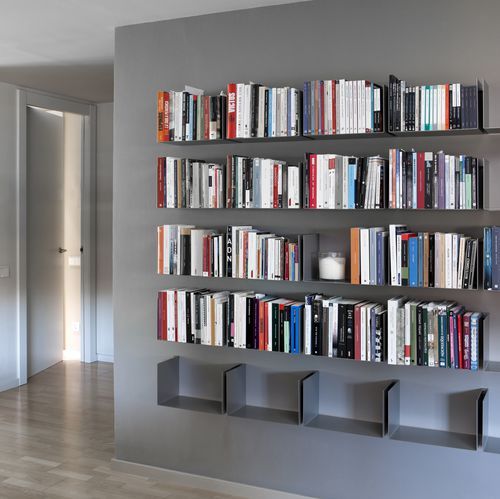
The image size is (500, 499). I want to click on empty shelf, so click(x=190, y=399), click(x=265, y=412), click(x=348, y=420), click(x=431, y=435).